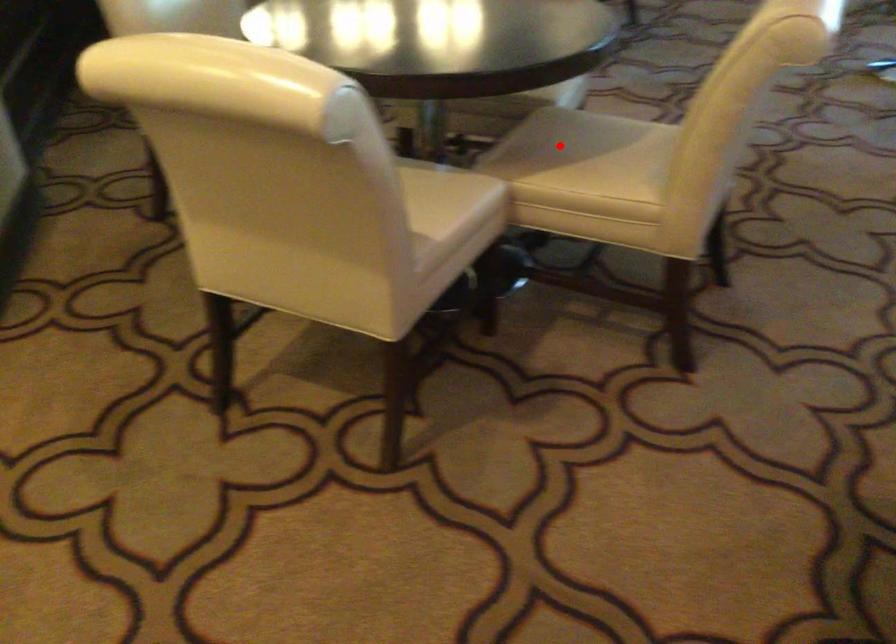
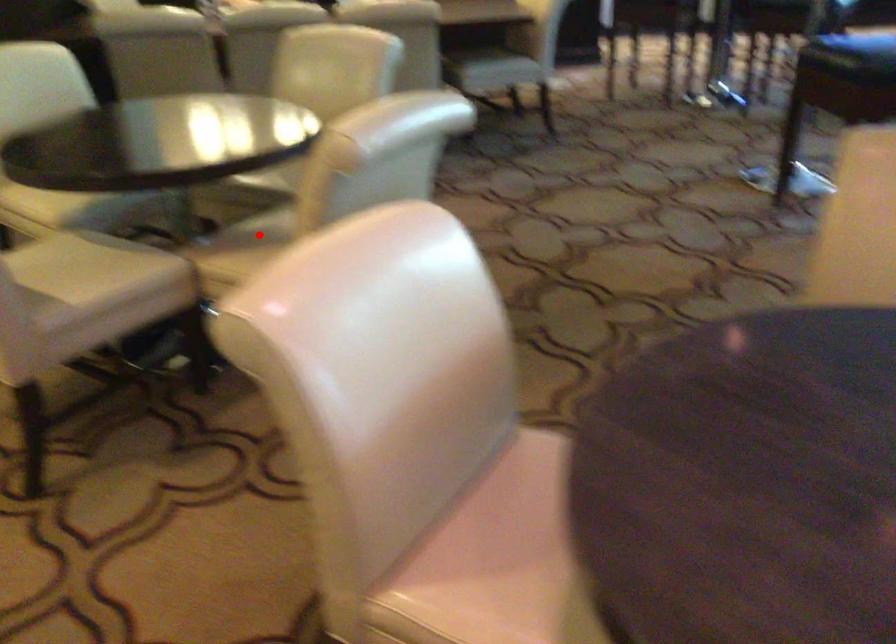
I am providing you with two images of the same scene from different viewpoints. A red point is marked on the first image and another point is marked on the second image. Is the red point in image1 aligned with the point shown in image2?

Yes